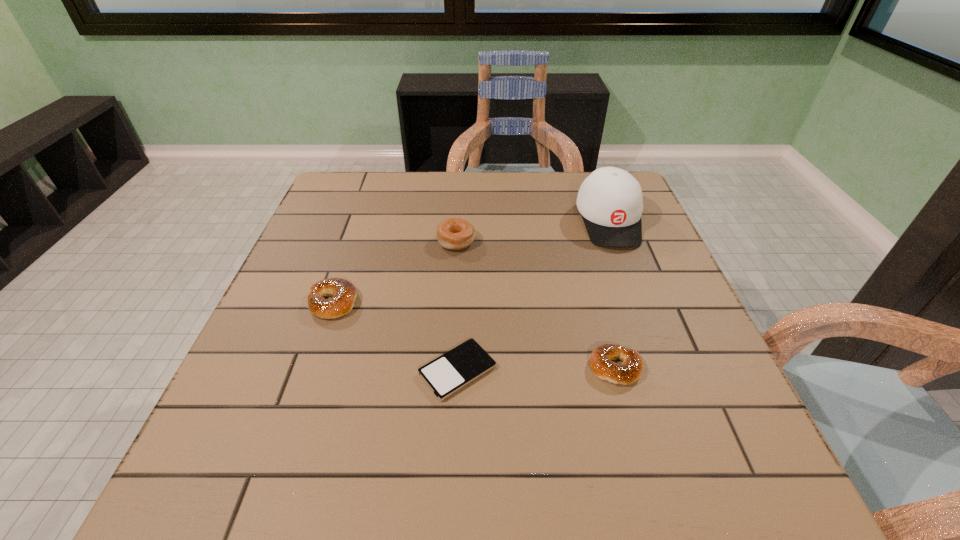
This screenshot has height=540, width=960. In order to click on blank space located on the back of the leftmost object in this screenshot , I will do `click(351, 249)`.

The width and height of the screenshot is (960, 540). Identify the location of free region located on the back of the nearest bagel. (582, 246).

In order to click on vacant space located on the right of the iPod in this screenshot , I will do `click(634, 370)`.

I want to click on object present at the far edge, so click(x=610, y=201).

Find the location of a particular element. object situated at the left edge is located at coordinates (344, 294).

In order to click on baseball cap at the right edge in this screenshot , I will do `click(610, 201)`.

Where is `bagel situated at the right edge`? The image size is (960, 540). bagel situated at the right edge is located at coordinates (630, 370).

Locate an element on the screen. object that is at the far right corner is located at coordinates (610, 201).

The image size is (960, 540). In order to click on blank space at the far edge in this screenshot , I will do `click(540, 173)`.

I want to click on vacant region at the near edge of the desktop, so click(x=345, y=461).